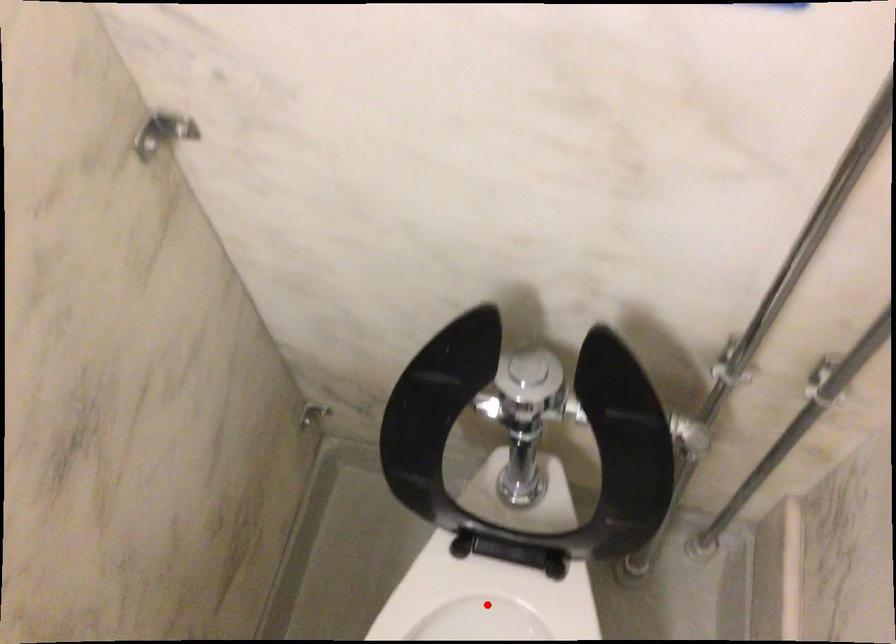
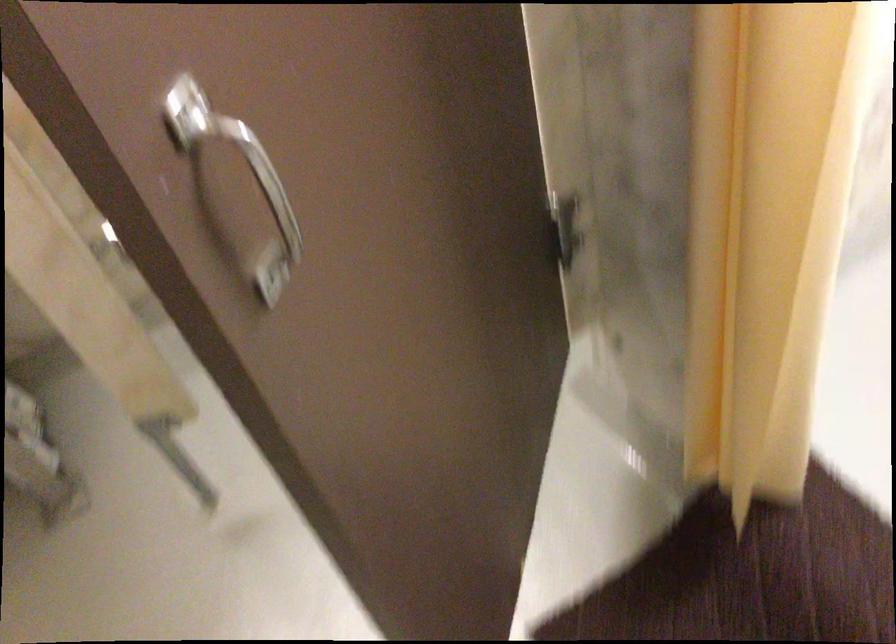
Question: I am providing you with two images of the same scene from different viewpoints. A red point is marked on the first image. Is the red point's position out of view in image 2?

Choices:
 (A) Yes
 (B) No

Answer: (A)